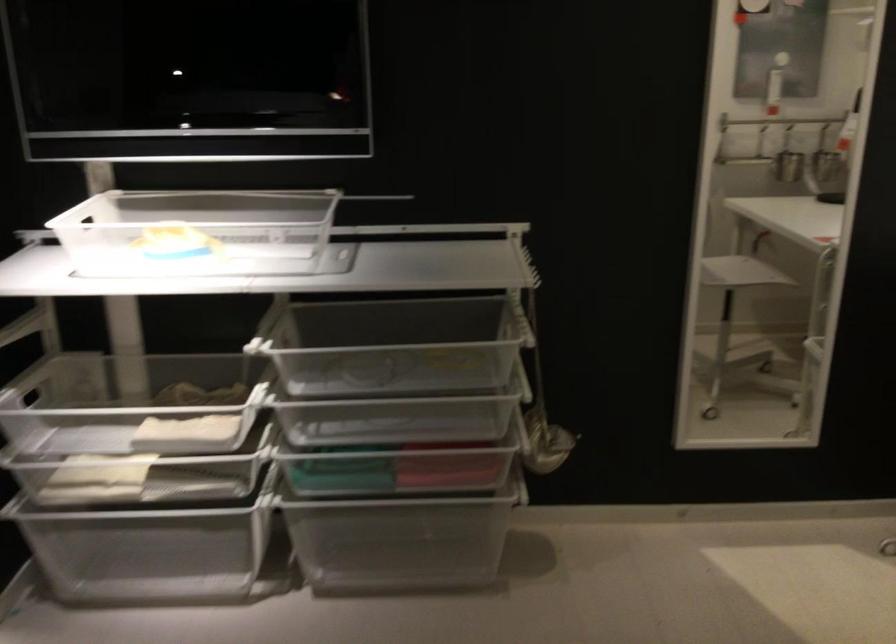
What do you see at coordinates (739, 272) in the screenshot? I see `the chair sitting surface` at bounding box center [739, 272].